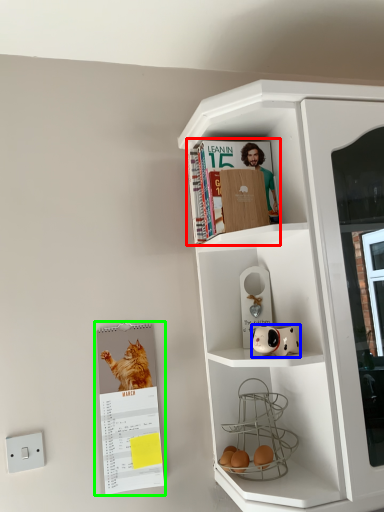
Question: Based on their relative distances, which object is nearer to magazine (highlighted by a red box)? Choose from toy (highlighted by a blue box) and paperback book (highlighted by a green box).

Choices:
 (A) toy
 (B) paperback book

Answer: (A)